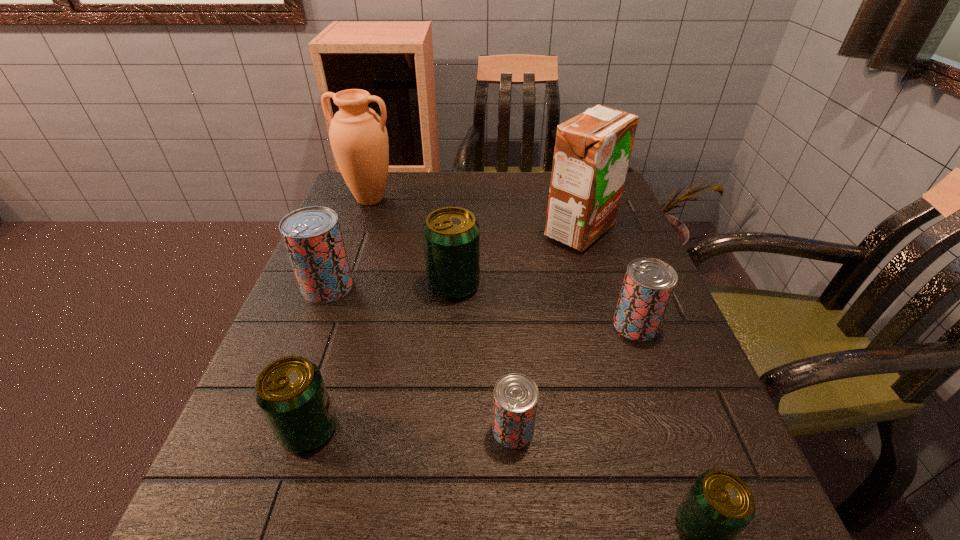
Locate an element on the screen. The width and height of the screenshot is (960, 540). object that ranks as the third closest to the leftmost red beer can is located at coordinates (290, 391).

Find the location of a particular element. the fifth closest beer can to the urn is located at coordinates (515, 400).

In order to click on beer can that is the third closest to the carton in this screenshot , I will do `click(515, 400)`.

You are a GUI agent. You are given a task and a screenshot of the screen. Output one action in this format:
    pyautogui.click(x=<x>, y=<y>)
    Task: Click on the green beer can that can be found as the closest to the second green beer can from right to left
    
    Given the screenshot: What is the action you would take?
    pyautogui.click(x=290, y=391)

Image resolution: width=960 pixels, height=540 pixels. I want to click on green beer can that is the third closest to the carton, so click(719, 506).

At what (x,y) coordinates should I click in order to perform the action: click on red beer can object that ranks as the second closest to the fourth object from left to right. Please return your answer as a coordinate pair (x, y). Looking at the image, I should click on (515, 400).

Locate which red beer can ranks in proximity to the fourth nearest beer can. Please provide its 2D coordinates. Your answer should be formatted as a tuple, i.e. [(x, y)], where the tuple contains the x and y coordinates of a point satisfying the conditions above.

[(515, 400)]

The width and height of the screenshot is (960, 540). I want to click on vacant space that satisfies the following two spatial constraints: 1. on the front side of the leftmost green beer can; 2. on the left side of the urn, so click(x=288, y=430).

At what (x,y) coordinates should I click in order to perform the action: click on free space that satisfies the following two spatial constraints: 1. on the back side of the biggest red beer can; 2. on the left side of the urn. Please return your answer as a coordinate pair (x, y). The width and height of the screenshot is (960, 540). Looking at the image, I should click on (362, 199).